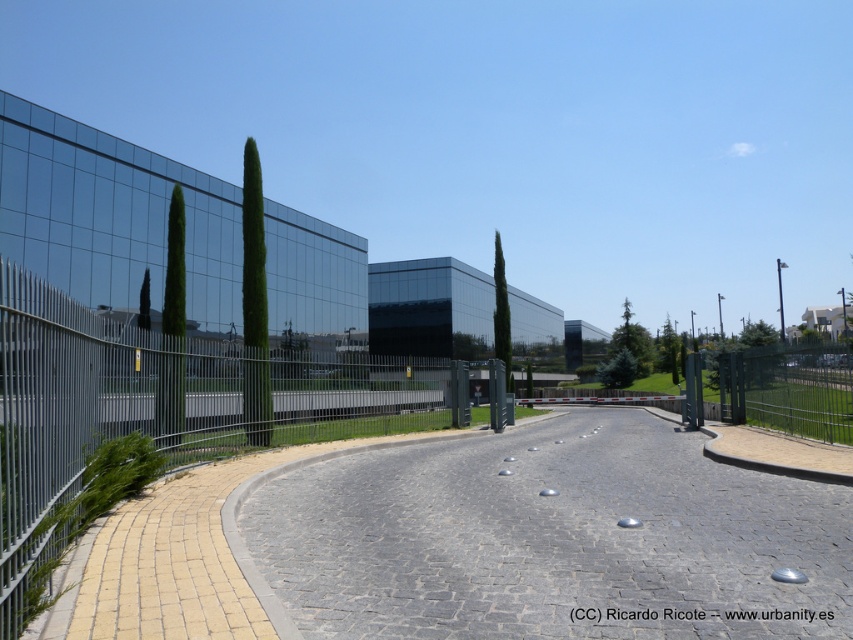
Which is in front, point (363, 632) or point (180, 342)?

Positioned in front is point (363, 632).

Does gray cobblestone pavement at center appear on the left side of green glossy cypress tree at left?

No, gray cobblestone pavement at center is not to the left of green glossy cypress tree at left.

Find the location of a particular element. gray cobblestone pavement at center is located at coordinates (553, 540).

Is gray cobblestone pavement at center behind green glossy cypress tree at center?

No, it is not.

Does gray cobblestone pavement at center have a greater width compared to green glossy cypress tree at center?

Answer: Yes, gray cobblestone pavement at center is wider than green glossy cypress tree at center.

Is point (822, 502) positioned in front of point (508, 352)?

Yes, point (822, 502) is closer to viewer.

This screenshot has height=640, width=853. Identify the location of gray cobblestone pavement at center. (x=553, y=540).

Can you confirm if gray cobblestone pavement at center is bigger than green glossy cypress at left?

No.

What do you see at coordinates (553, 540) in the screenshot? I see `gray cobblestone pavement at center` at bounding box center [553, 540].

The height and width of the screenshot is (640, 853). I want to click on gray cobblestone pavement at center, so (553, 540).